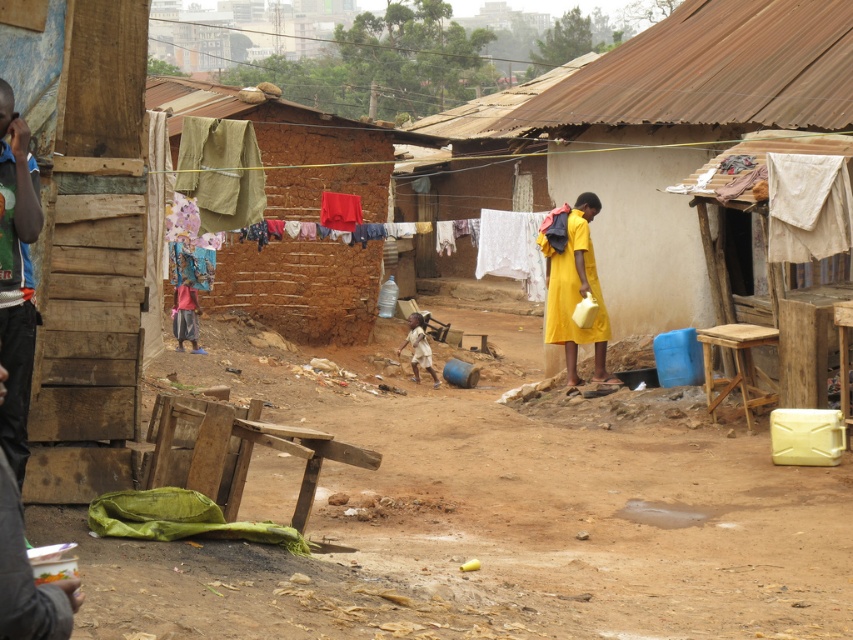
Question: Does brown dirt field at center appear over light brown fabric shirt at center?

Choices:
 (A) no
 (B) yes

Answer: (A)

Question: Which point is farther to the camera?

Choices:
 (A) (412, 588)
 (B) (412, 369)
 (C) (10, 144)

Answer: (B)

Question: Which is farther from the green jersey at left?

Choices:
 (A) light brown fabric shirt at center
 (B) brown dirt field at center
 (C) yellow matte dress at center
 (D) olive green fabric at upper center

Answer: (A)

Question: Does brown dirt field at center have a larger size compared to wooden planks at left?

Choices:
 (A) yes
 (B) no

Answer: (A)

Question: Is wooden planks at left to the right of green jersey at left from the viewer's perspective?

Choices:
 (A) yes
 (B) no

Answer: (B)

Question: Among these objects, which one is farthest from the camera?

Choices:
 (A) brown dirt field at center
 (B) light brown fabric shirt at center
 (C) olive green fabric at upper center

Answer: (B)